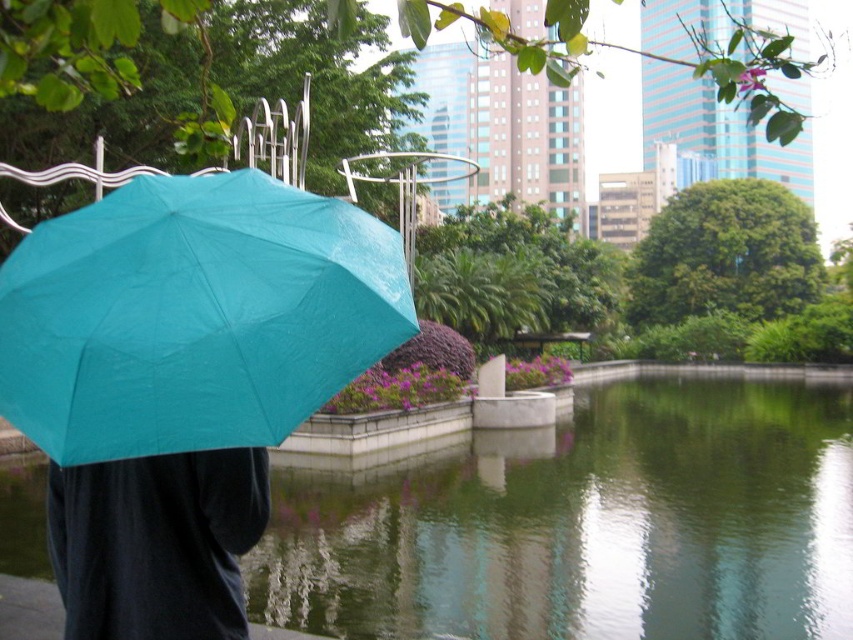
Question: Does green reflective water at center have a lesser width compared to matte black pants at lower left?

Choices:
 (A) no
 (B) yes

Answer: (A)

Question: From the image, what is the correct spatial relationship of teal matte umbrella at left in relation to matte black pants at lower left?

Choices:
 (A) right
 (B) left

Answer: (A)

Question: Which of the following is the closest to the observer?

Choices:
 (A) teal matte umbrella at left
 (B) green reflective water at center
 (C) matte black pants at lower left

Answer: (A)

Question: Estimate the real-world distances between objects in this image. Which object is farther from the green reflective water at center?

Choices:
 (A) teal matte umbrella at left
 (B) matte black pants at lower left

Answer: (A)

Question: Can you confirm if green reflective water at center is bigger than teal matte umbrella at left?

Choices:
 (A) no
 (B) yes

Answer: (B)

Question: Which of the following is the closest to the observer?

Choices:
 (A) teal matte umbrella at left
 (B) green reflective water at center

Answer: (A)